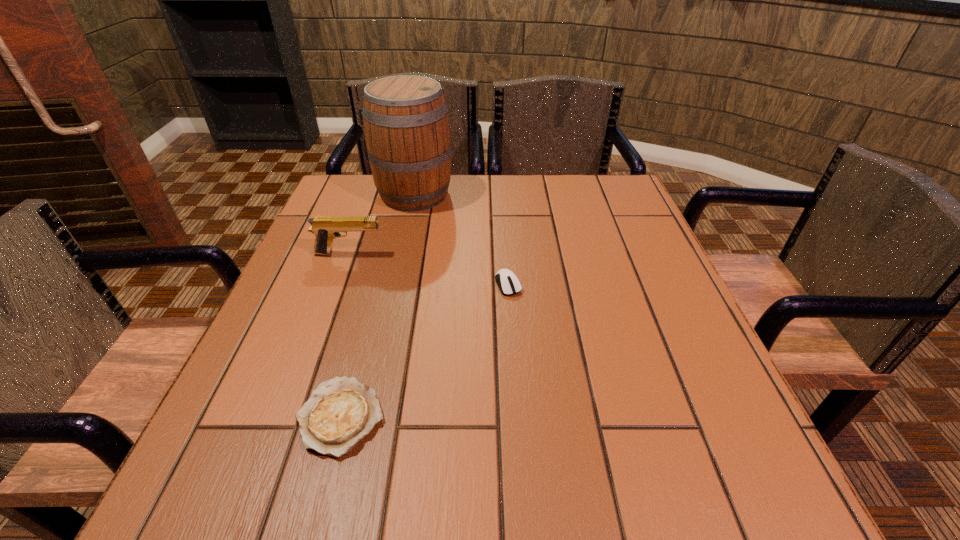
Find the location of `vacant space that's between the rightmost object and the tallest object`. vacant space that's between the rightmost object and the tallest object is located at coordinates (461, 239).

Identify the location of empty location between the shortest object and the second shortest object. Image resolution: width=960 pixels, height=540 pixels. (424, 350).

Locate an element on the screen. This screenshot has width=960, height=540. empty location between the third shortest object and the farthest object is located at coordinates (382, 224).

Locate an element on the screen. The image size is (960, 540). vacant area between the third nearest object and the tallest object is located at coordinates (382, 224).

Where is `empty space that is in between the second shortest object and the nearest object`? empty space that is in between the second shortest object and the nearest object is located at coordinates (424, 350).

Identify the location of free space between the third nearest object and the rightmost object. The width and height of the screenshot is (960, 540). (428, 269).

Identify which object is located as the nearest to the pistol. Please provide its 2D coordinates. Your answer should be formatted as a tuple, i.e. [(x, y)], where the tuple contains the x and y coordinates of a point satisfying the conditions above.

[(406, 126)]

Find the location of a particular element. object that is the closest to the quiche is located at coordinates (508, 283).

This screenshot has height=540, width=960. In order to click on free space in the image that satisfies the following two spatial constraints: 1. on the front side of the tallest object; 2. at the barrel of the pistol in this screenshot , I will do 401,254.

The width and height of the screenshot is (960, 540). In order to click on free space that satisfies the following two spatial constraints: 1. on the back side of the mouse; 2. at the barrel of the second tallest object in this screenshot , I will do `click(506, 254)`.